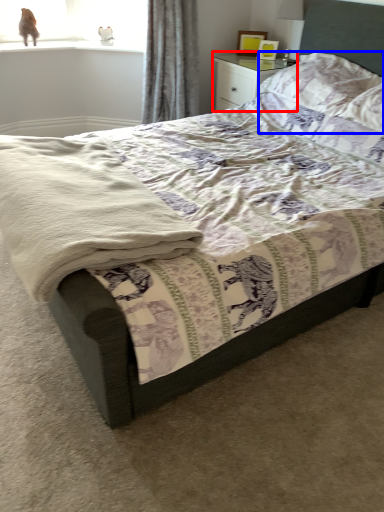
Question: Which point is closer to the camera, nightstand (highlighted by a red box) or pillow (highlighted by a blue box)?

Choices:
 (A) nightstand
 (B) pillow

Answer: (B)